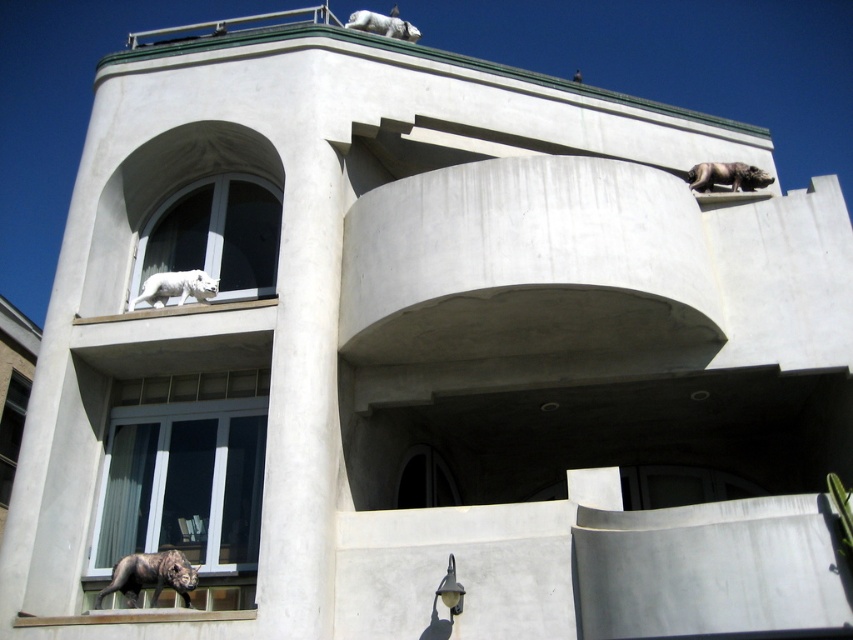
Question: Can you confirm if transparent glass window at lower center is wider than gray stone elephant at upper right?

Choices:
 (A) no
 (B) yes

Answer: (A)

Question: Is white marble window at center to the left of shiny black statue at lower left from the viewer's perspective?

Choices:
 (A) yes
 (B) no

Answer: (A)

Question: Among these objects, which one is farthest from the camera?

Choices:
 (A) white marble tiger at lower left
 (B) shiny black statue at lower left
 (C) gray stone elephant at upper right
 (D) white marble tiger at upper center

Answer: (D)

Question: Which object is positioned farthest from the transparent glass window at lower left?

Choices:
 (A) shiny black statue at lower left
 (B) white marble tiger at lower left
 (C) gray stone elephant at upper right

Answer: (C)

Question: Which of these objects is positioned farthest from the shiny black statue at lower left?

Choices:
 (A) white marble tiger at upper center
 (B) gray stone elephant at upper right

Answer: (A)

Question: Does transparent glass window at lower center have a smaller size compared to gray stone elephant at upper right?

Choices:
 (A) no
 (B) yes

Answer: (B)